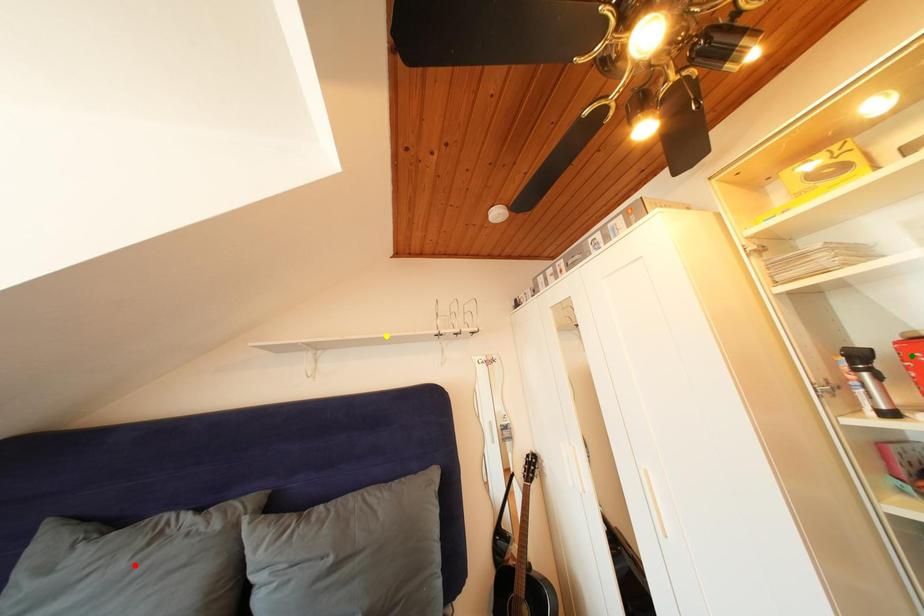
Order these from nearest to farthest:
red point | green point | yellow point

1. yellow point
2. red point
3. green point